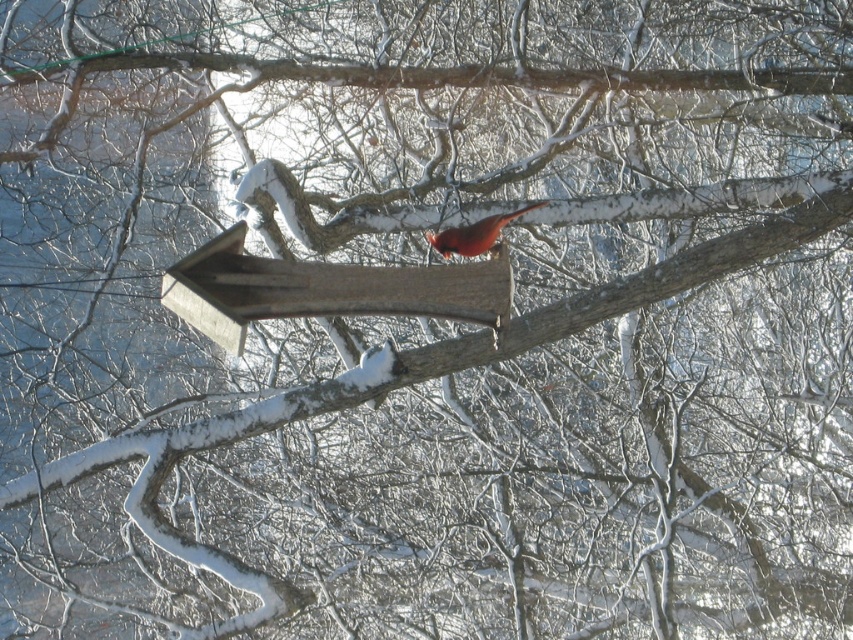
Question: Which point is closer to the camera?

Choices:
 (A) wooden bird feeder at center
 (B) matte red bird at center

Answer: (A)

Question: Does wooden bird feeder at center appear on the right side of matte red bird at center?

Choices:
 (A) no
 (B) yes

Answer: (A)

Question: Is wooden bird feeder at center bigger than matte red bird at center?

Choices:
 (A) no
 (B) yes

Answer: (B)

Question: Is wooden bird feeder at center below matte red bird at center?

Choices:
 (A) yes
 (B) no

Answer: (A)